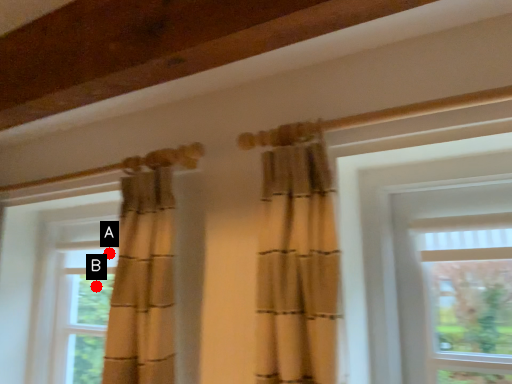
Question: Two points are circled on the image, labeled by A and B beside each circle. Which point is closer to the camera?

Choices:
 (A) A is closer
 (B) B is closer

Answer: (A)